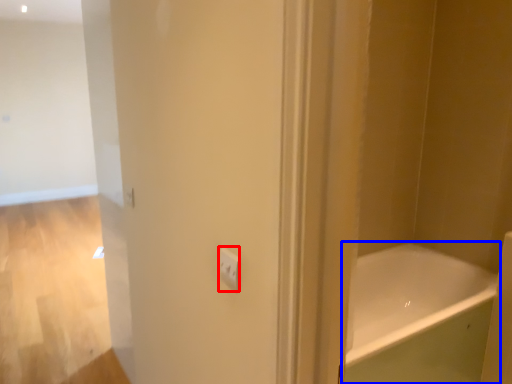
Question: Which of the following is the closest to the observer, light switch (highlighted by a red box) or bathtub (highlighted by a blue box)?

Choices:
 (A) light switch
 (B) bathtub

Answer: (A)